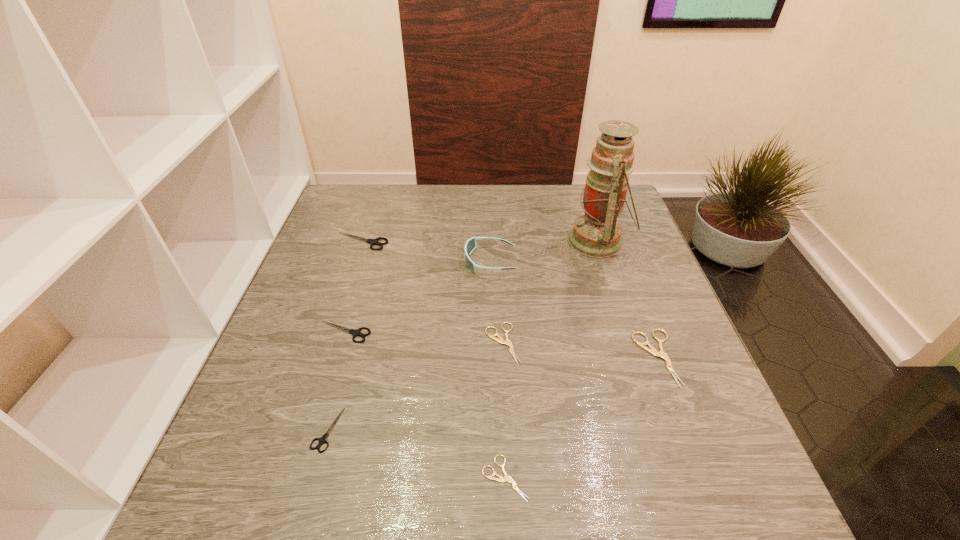
Where is `beige shears that is the third nearest to the red oil lamp`? beige shears that is the third nearest to the red oil lamp is located at coordinates pos(507,478).

Find the location of a particular element. The image size is (960, 540). vacant space that satisfies the following two spatial constraints: 1. on the front-facing side of the goggles; 2. on the left side of the rightmost shears is located at coordinates (492, 357).